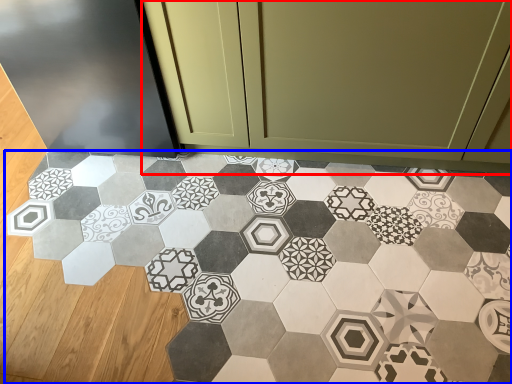
Question: Which point is further to the camera, cabinetry (highlighted by a red box) or porcelain (highlighted by a blue box)?

Choices:
 (A) cabinetry
 (B) porcelain

Answer: (A)